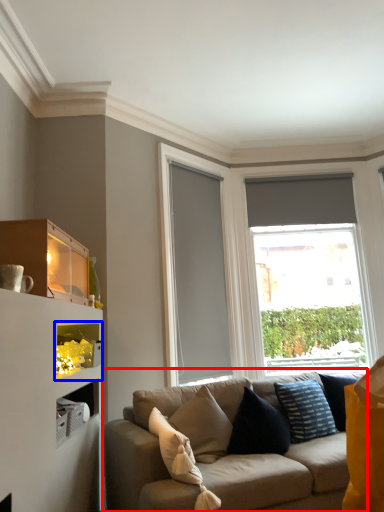
Question: Which of the following is the closest to the observer, studio couch (highlighted by a red box) or cabinet (highlighted by a blue box)?

Choices:
 (A) studio couch
 (B) cabinet

Answer: (A)